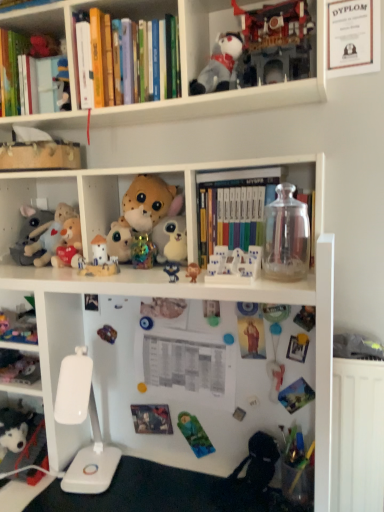
Question: Which direction should I rotate to look at blue fabric plush at center, which is the sixth toy from bottom to top?

Choices:
 (A) right
 (B) left

Answer: (B)

Question: Is the position of white plastic toy at center, which is the ninth toy in bottom-to-top order, more distant than that of porcelain figurines at center, the eighth toy when ordered from bottom to top?

Choices:
 (A) no
 (B) yes

Answer: (B)

Question: Does white plastic toy at center, which is the ninth toy in bottom-to-top order, have a greater width compared to porcelain figurines at center, which is the eighth toy in top-to-bottom order?

Choices:
 (A) yes
 (B) no

Answer: (B)

Question: From a real-world perspective, is white plastic toy at center, the 7th toy in the top-to-bottom sequence, positioned over porcelain figurines at center, the eighth toy when ordered from bottom to top, based on gravity?

Choices:
 (A) yes
 (B) no

Answer: (A)

Question: From the image's perspective, does white plastic toy at center, the 7th toy in the top-to-bottom sequence, appear lower than porcelain figurines at center, the eighth toy when ordered from bottom to top?

Choices:
 (A) no
 (B) yes

Answer: (A)

Question: Is white plastic toy at center, the 7th toy in the top-to-bottom sequence, not within porcelain figurines at center, the eighth toy when ordered from bottom to top?

Choices:
 (A) yes
 (B) no

Answer: (A)

Question: Does transparent glass jar at upper right, the fifth toy viewed from the top, have a lesser height compared to fluffy plush bear at center, the 3th toy in the top-to-bottom sequence?

Choices:
 (A) yes
 (B) no

Answer: (B)

Question: Is transparent glass jar at upper right, the fifth toy viewed from the top, oriented away from fluffy plush bear at center, which ranks as the thirteenth toy in bottom-to-top order?

Choices:
 (A) no
 (B) yes

Answer: (A)

Question: Can you confirm if transparent glass jar at upper right, the fifth toy viewed from the top, is smaller than fluffy plush bear at center, the 3th toy in the top-to-bottom sequence?

Choices:
 (A) yes
 (B) no

Answer: (A)

Question: From a real-world perspective, does transparent glass jar at upper right, acting as the 11th toy starting from the bottom, stand above fluffy plush bear at center, which ranks as the thirteenth toy in bottom-to-top order?

Choices:
 (A) yes
 (B) no

Answer: (B)

Question: From the image's perspective, does transparent glass jar at upper right, acting as the 11th toy starting from the bottom, appear lower than fluffy plush bear at center, the 3th toy in the top-to-bottom sequence?

Choices:
 (A) no
 (B) yes

Answer: (B)

Question: Is transparent glass jar at upper right, the fifth toy viewed from the top, completely or partially outside of fluffy plush bear at center, the 3th toy in the top-to-bottom sequence?

Choices:
 (A) no
 (B) yes

Answer: (B)

Question: Is white plush dog at lower left, arranged as the 1th toy when ordered from the bottom, positioned far away from fluffy plush bear at center, which ranks as the thirteenth toy in bottom-to-top order?

Choices:
 (A) yes
 (B) no

Answer: (B)